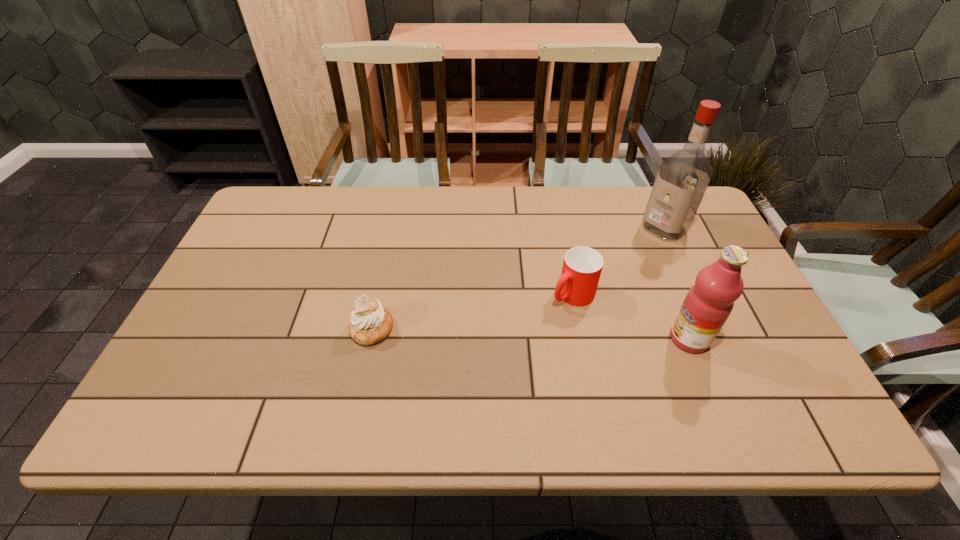
I want to click on vacant space on the desktop that is between the leftmost object and the second tallest object and is positioned on the front-facing side of the farthest object, so click(526, 333).

The height and width of the screenshot is (540, 960). Identify the location of free space on the desktop that is between the leftmost object and the fruit juice and is positioned on the side of the second shortest object with the handle. (513, 333).